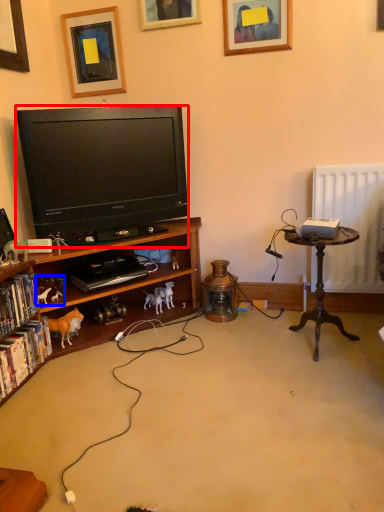
Question: Which object is further to the camera taking this photo, television (highlighted by a red box) or toy (highlighted by a blue box)?

Choices:
 (A) television
 (B) toy

Answer: (B)